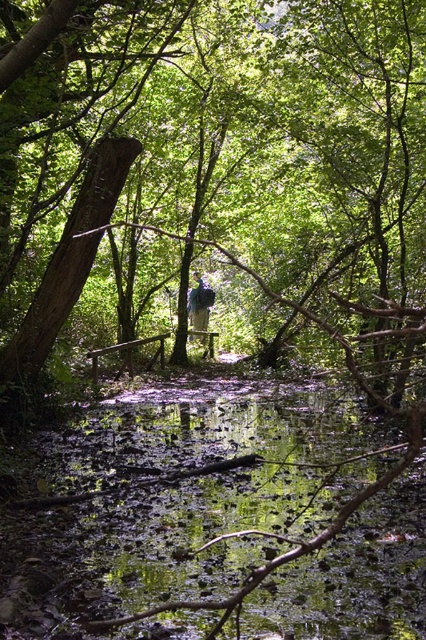
You are a hiker who wants to cross the path in the forest. You see the green mossy water at center and the blue fabric backpack at center. Which object is lower in position?

The green mossy water at center is below the blue fabric backpack at center, so the green mossy water at center is lower in position.

You are a hiker trying to cross the path in the forest. You need to step on the smooth brown tree trunk at center to avoid the green mossy water at center. Can you step on the tree trunk without slipping into the water?

The smooth brown tree trunk at center might be wider than green mossy water at center, so there is a possibility that the tree trunk is wide enough to step on without slipping into the water. However, since the width comparison is uncertain, caution is advised.

In the scene shown: You are a hiker trying to cross the path in the forest. There is green mossy water at center. Where exactly is the green mossy water located in the image?

The green mossy water at center is located at point 0.809 on the x axis and 0.509 on the y axis.